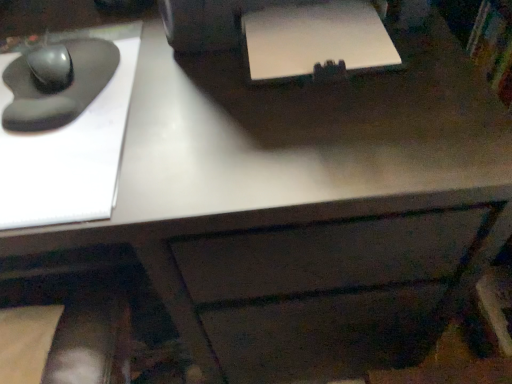
Question: Considering the relative positions of white matte printer at upper center and matte black mouse at left, positioned as the second mouse in bottom-to-top order, in the image provided, is white matte printer at upper center behind matte black mouse at left, positioned as the second mouse in bottom-to-top order,?

Choices:
 (A) yes
 (B) no

Answer: (B)

Question: Does white matte printer at upper center have a larger size compared to matte black mouse at left, positioned as the second mouse in bottom-to-top order?

Choices:
 (A) no
 (B) yes

Answer: (B)

Question: From the image's perspective, is white matte printer at upper center beneath matte black mouse at left, placed as the 1th mouse when sorted from top to bottom?

Choices:
 (A) no
 (B) yes

Answer: (A)

Question: Does white matte printer at upper center appear on the right side of matte black mouse at left, placed as the 1th mouse when sorted from top to bottom?

Choices:
 (A) yes
 (B) no

Answer: (A)

Question: From a real-world perspective, is white matte printer at upper center positioned under matte black mouse at left, positioned as the second mouse in bottom-to-top order, based on gravity?

Choices:
 (A) no
 (B) yes

Answer: (A)

Question: Is matte black mouse at left, placed as the 1th mouse when sorted from top to bottom, inside white matte printer at upper center?

Choices:
 (A) yes
 (B) no

Answer: (B)

Question: Considering the relative sizes of matte black mouse at left, positioned as the second mouse in bottom-to-top order, and white matte printer at upper center in the image provided, is matte black mouse at left, positioned as the second mouse in bottom-to-top order, shorter than white matte printer at upper center?

Choices:
 (A) no
 (B) yes

Answer: (A)

Question: Is matte black mouse at left, positioned as the second mouse in bottom-to-top order, facing towards white matte printer at upper center?

Choices:
 (A) yes
 (B) no

Answer: (B)

Question: From the image's perspective, does matte black mouse at left, positioned as the second mouse in bottom-to-top order, appear lower than white matte printer at upper center?

Choices:
 (A) no
 (B) yes

Answer: (B)

Question: Considering the relative positions of matte black mouse at left, placed as the 1th mouse when sorted from top to bottom, and white matte printer at upper center in the image provided, is matte black mouse at left, placed as the 1th mouse when sorted from top to bottom, to the left of white matte printer at upper center from the viewer's perspective?

Choices:
 (A) yes
 (B) no

Answer: (A)

Question: Does matte black mouse at left, positioned as the second mouse in bottom-to-top order, have a larger size compared to white matte printer at upper center?

Choices:
 (A) no
 (B) yes

Answer: (A)

Question: Would you say matte black mouse at left, positioned as the second mouse in bottom-to-top order, contains white matte printer at upper center?

Choices:
 (A) yes
 (B) no

Answer: (B)

Question: Does white matte printer at upper center have a lesser height compared to matte black mouse at left, the first mouse when ordered from bottom to top?

Choices:
 (A) yes
 (B) no

Answer: (A)